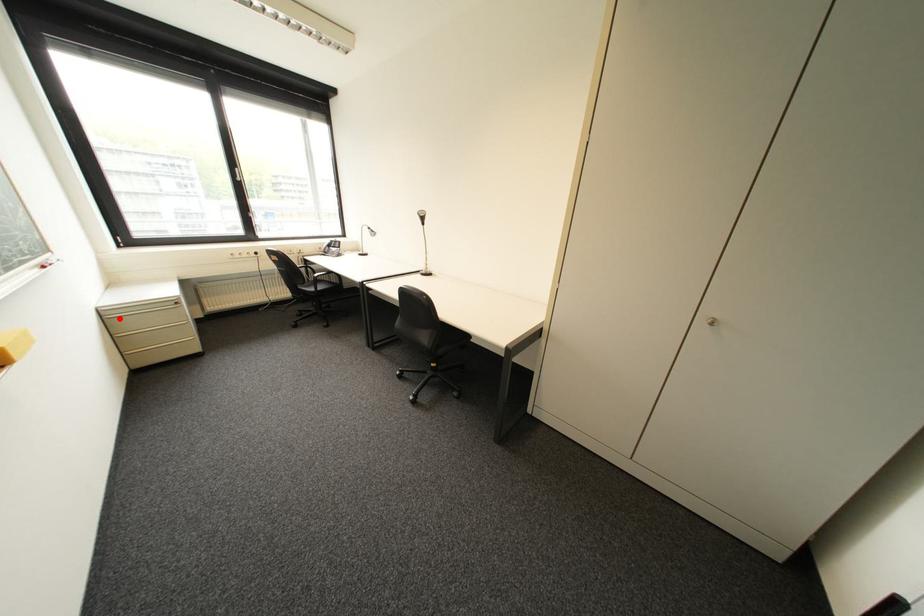
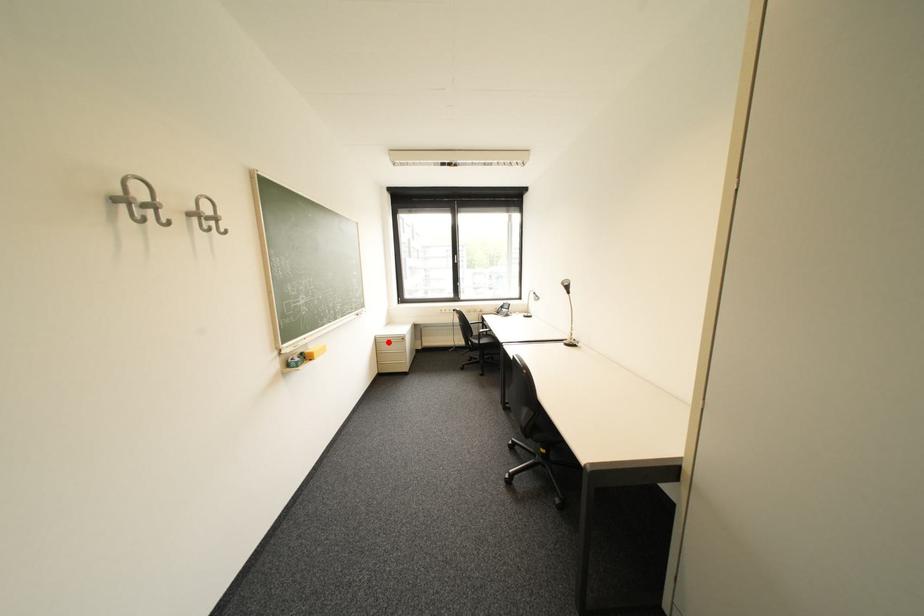
I am providing you with two images of the same scene from different viewpoints. A red point is marked on the first image and another point is marked on the second image. Do the highlighted points in image1 and image2 indicate the same real-world spot?

Yes